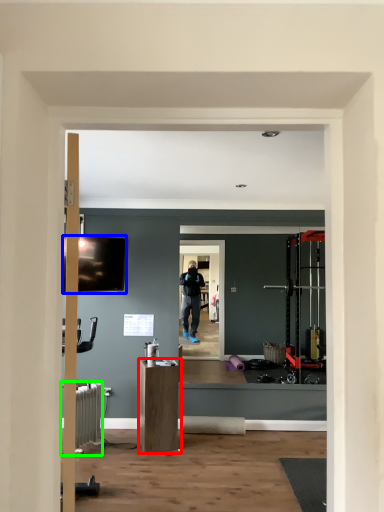
Question: Considering the real-world distances, which object is farthest from furniture (highlighted by a red box)? television (highlighted by a blue box) or radiator (highlighted by a green box)?

Choices:
 (A) television
 (B) radiator

Answer: (A)